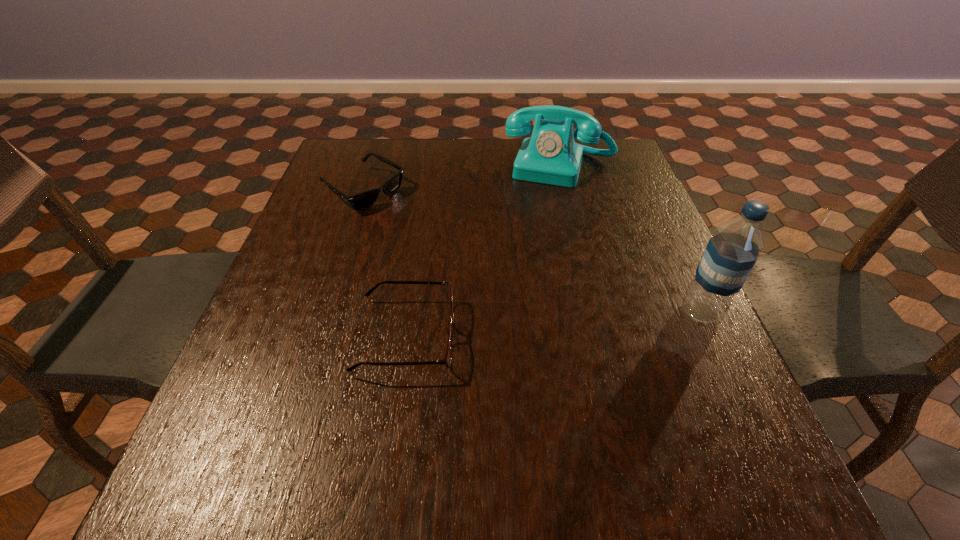
Where is `free space on the desktop that is between the spectacles and the tallest object and is positioned on the front-facing side of the sunglasses`? free space on the desktop that is between the spectacles and the tallest object and is positioned on the front-facing side of the sunglasses is located at coordinates (577, 322).

This screenshot has width=960, height=540. Identify the location of free space on the desktop that is between the spectacles and the rightmost object and is positioned on the dial of the telephone. (515, 327).